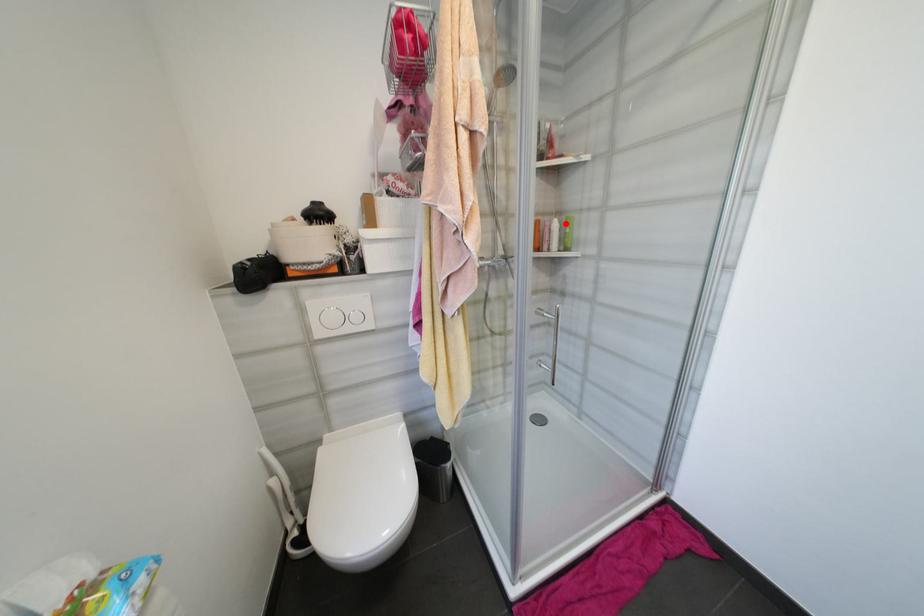
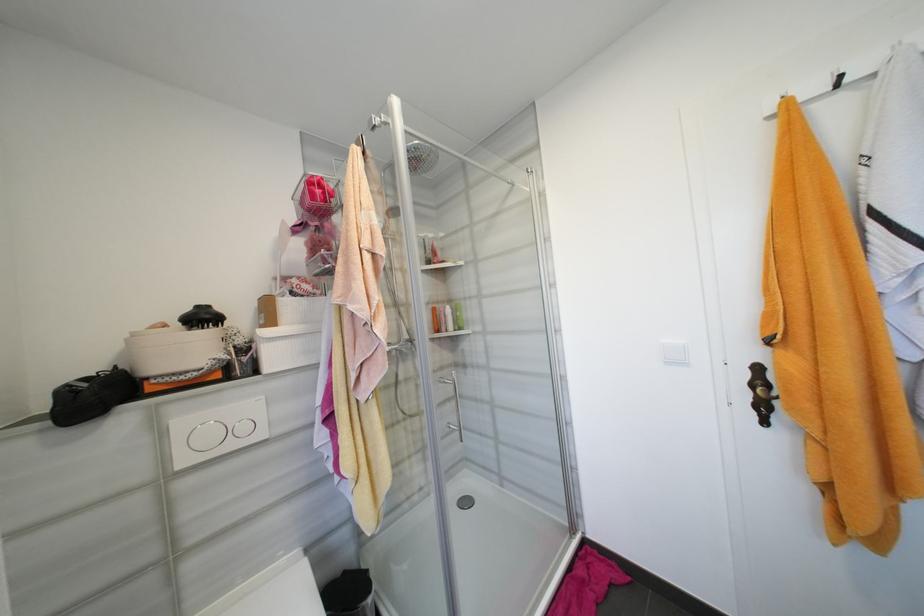
Question: I am providing you with two images of the same scene from different viewpoints. Given a red point in image1, look at the same physical point in image2. Is it:

Choices:
 (A) Closer to the viewpoint
 (B) Farther from the viewpoint

Answer: (B)